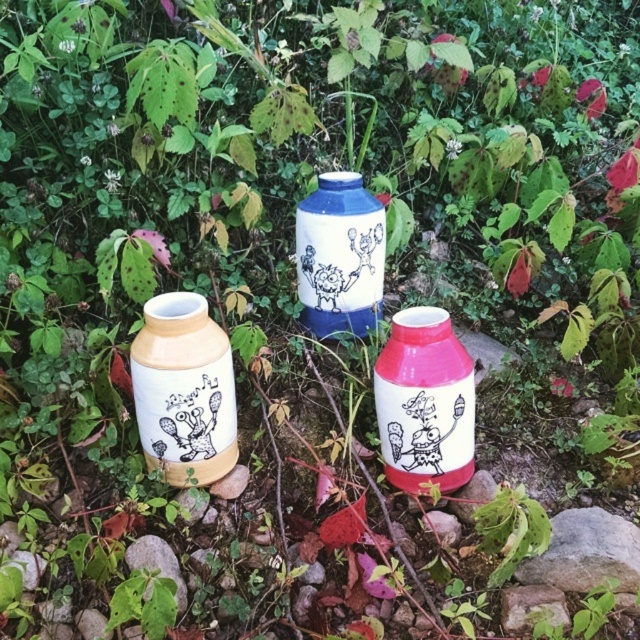
Question: Is the position of matte yellow vase at left less distant than that of blue glazed vase at center?

Choices:
 (A) no
 (B) yes

Answer: (B)

Question: Can you confirm if matte yellow vase at left is positioned below matte ceramic bottle at center?

Choices:
 (A) no
 (B) yes

Answer: (A)

Question: Which of these objects is positioned closest to the blue glazed vase at center?

Choices:
 (A) matte ceramic bottle at center
 (B) matte yellow vase at left

Answer: (A)

Question: Can you confirm if matte yellow vase at left is positioned below blue glazed vase at center?

Choices:
 (A) no
 (B) yes

Answer: (B)

Question: Among these points, which one is farthest from the camera?

Choices:
 (A) (538, 580)
 (B) (346, 259)
 (C) (160, 438)

Answer: (B)

Question: Which of these objects is positioned farthest from the gray rock at center?

Choices:
 (A) blue glazed vase at center
 (B) matte yellow vase at left

Answer: (B)